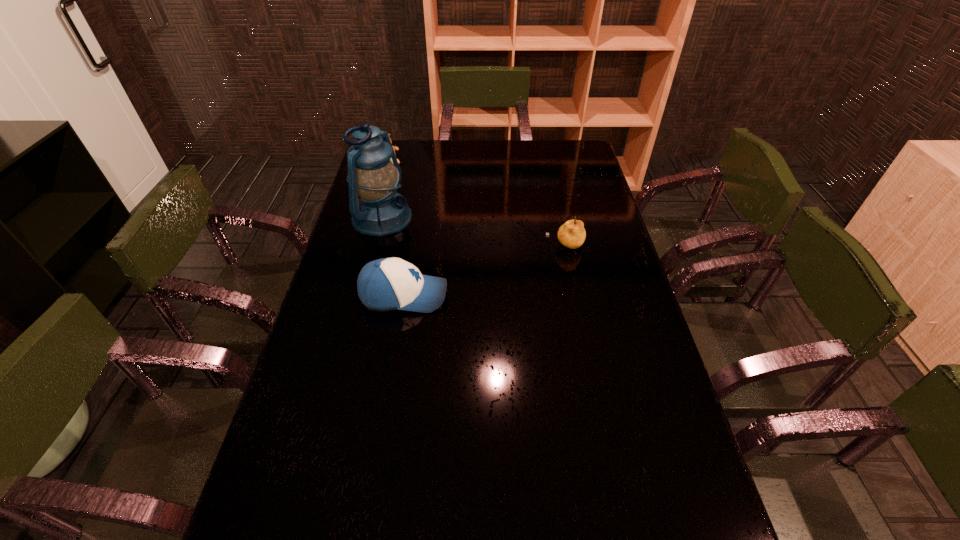
The width and height of the screenshot is (960, 540). Identify the location of vacant space positioned on the front-facing side of the teddy bear. (431, 219).

Where is `free point located 0.190m on the front-facing side of the teddy bear`? This screenshot has height=540, width=960. free point located 0.190m on the front-facing side of the teddy bear is located at coordinates (410, 191).

What are the coordinates of `object positioned at the far edge` in the screenshot? It's located at (394, 147).

The width and height of the screenshot is (960, 540). I want to click on baseball cap at the left edge, so click(x=386, y=284).

Identify the location of lantern that is at the left edge. point(374,176).

Locate an element on the screen. teddy bear at the left edge is located at coordinates (394, 147).

Identify the location of object that is at the right edge. The width and height of the screenshot is (960, 540). tap(571, 234).

At what (x,y) coordinates should I click in order to perform the action: click on object situated at the far left corner. Please return your answer as a coordinate pair (x, y). This screenshot has width=960, height=540. Looking at the image, I should click on (394, 147).

Find the location of `free region at the far edge`. free region at the far edge is located at coordinates 464,163.

Identify the location of free space at the near edge. The width and height of the screenshot is (960, 540). (420, 494).